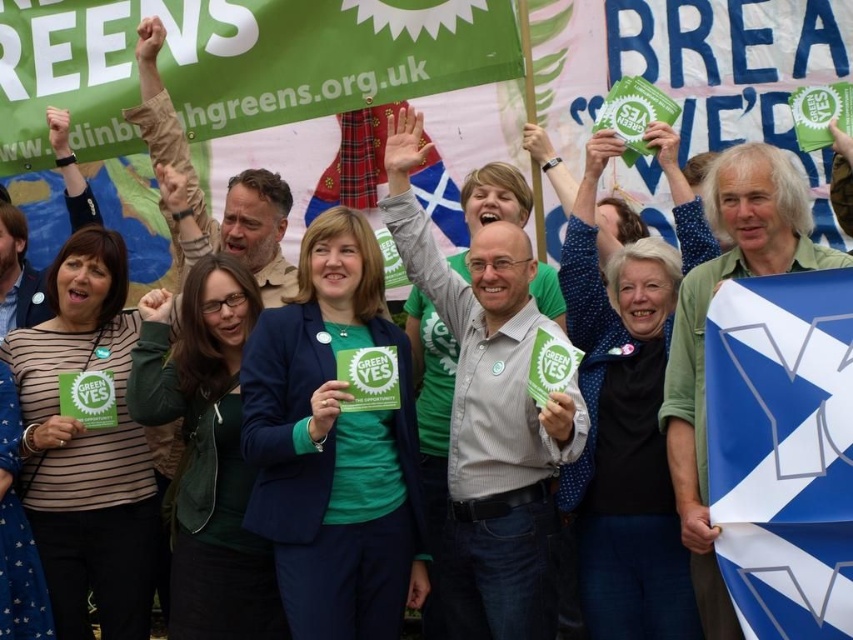
Question: Does green fabric banner at upper left have a smaller size compared to blue fabric flag at right?

Choices:
 (A) yes
 (B) no

Answer: (B)

Question: Is green fabric banner at upper left further to camera compared to blue fabric flag at right?

Choices:
 (A) yes
 (B) no

Answer: (A)

Question: Is green fabric banner at upper left to the left of blue fabric flag at right from the viewer's perspective?

Choices:
 (A) no
 (B) yes

Answer: (B)

Question: Among these objects, which one is farthest from the camera?

Choices:
 (A) blue fabric flag at right
 (B) green fabric banner at upper left

Answer: (B)

Question: Which object appears closest to the camera in this image?

Choices:
 (A) green fabric banner at upper left
 (B) blue fabric flag at right

Answer: (B)